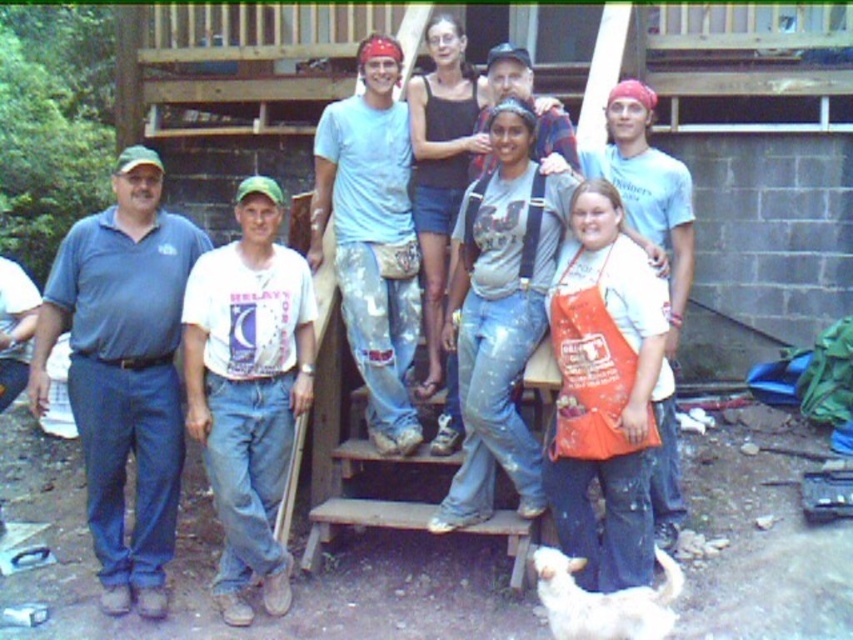
Question: Can you confirm if orange canvas apron at center is thinner than white fluffy dog at lower right?

Choices:
 (A) yes
 (B) no

Answer: (A)

Question: Can you confirm if wooden at upper center is bigger than matte blue t-shirt at center?

Choices:
 (A) no
 (B) yes

Answer: (A)

Question: Which object is the closest to the white cotton shirt at center?

Choices:
 (A) blue cotton shirt at left
 (B) white fluffy dog at lower right

Answer: (A)

Question: From the image, what is the correct spatial relationship of blue cotton shirt at left in relation to orange canvas apron at center?

Choices:
 (A) left
 (B) right

Answer: (A)

Question: Which of these objects is positioned farthest from the blue cotton shirt at left?

Choices:
 (A) orange canvas apron at center
 (B) wooden at upper center
 (C) white fluffy dog at lower right

Answer: (B)

Question: Which point is farther from the camera taking this photo?

Choices:
 (A) (672, 625)
 (B) (669, 541)
 (C) (341, 173)
 (D) (206, 8)

Answer: (D)